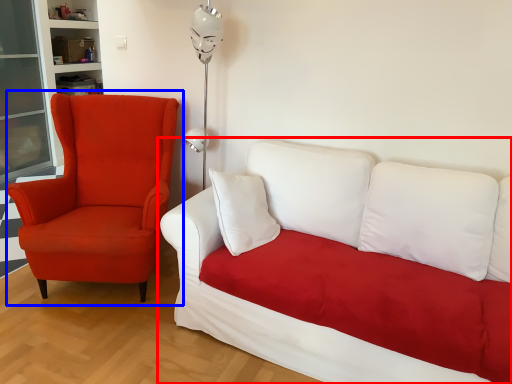
Question: Among these objects, which one is farthest to the camera, studio couch (highlighted by a red box) or chair (highlighted by a blue box)?

Choices:
 (A) studio couch
 (B) chair

Answer: (B)